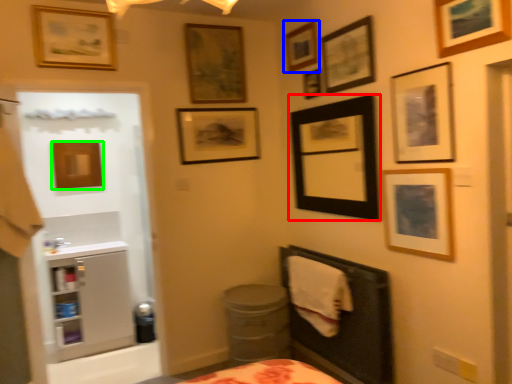
Question: Which object is positioned closest to picture frame (highlighted by a red box)? Select from picture frame (highlighted by a blue box) and picture frame (highlighted by a green box).

Choices:
 (A) picture frame
 (B) picture frame

Answer: (A)